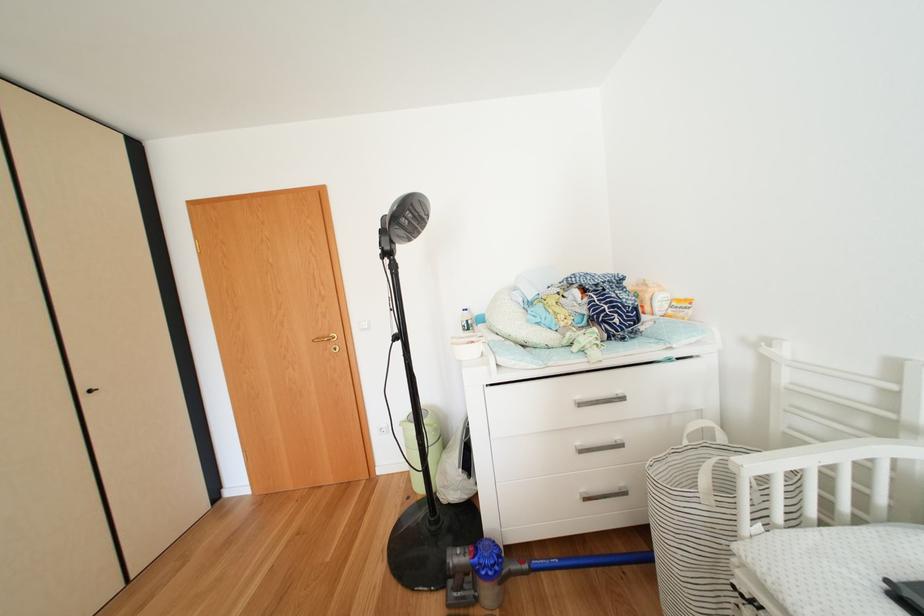
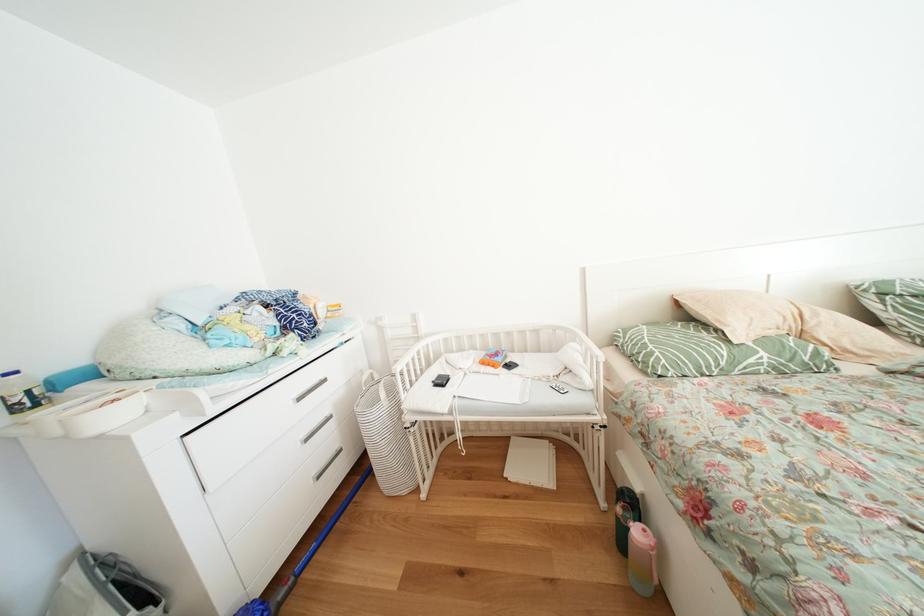
Question: The camera is either moving clockwise (left) or counter-clockwise (right) around the object. The first image is from the beginning of the video and the second image is from the end. Is the camera moving left or right when shooting the video?

Choices:
 (A) Left
 (B) Right

Answer: (A)